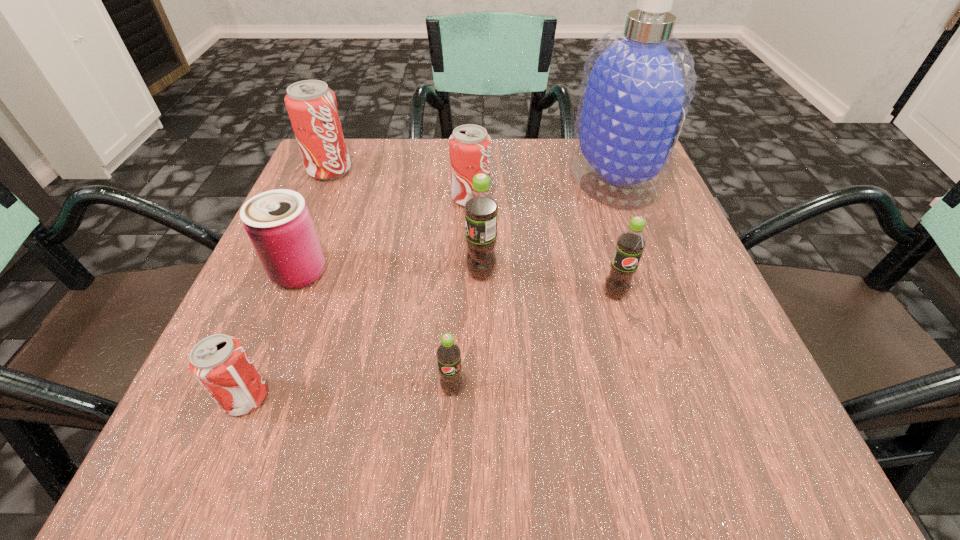
Identify which pink soda can is located as the second nearest to the cleansing agent. Please provide its 2D coordinates. Your answer should be formatted as a tuple, i.e. [(x, y)], where the tuple contains the x and y coordinates of a point satisfying the conditions above.

[(312, 107)]

Identify the location of pink soda can that is the second closest to the tallest object. (312, 107).

Identify which green soda is located as the nearest to the biggest green soda. Please provide its 2D coordinates. Your answer should be formatted as a tuple, i.e. [(x, y)], where the tuple contains the x and y coordinates of a point satisfying the conditions above.

[(630, 244)]

You are a GUI agent. You are given a task and a screenshot of the screen. Output one action in this format:
    pyautogui.click(x=<x>, y=<y>)
    Task: Click on the green soda that can be found as the third closest to the pink can
    The width and height of the screenshot is (960, 540).
    Given the screenshot: What is the action you would take?
    pyautogui.click(x=630, y=244)

You are a GUI agent. You are given a task and a screenshot of the screen. Output one action in this format:
    pyautogui.click(x=<x>, y=<y>)
    Task: Click on the free region that satisfies the following two spatial constraints: 1. on the front label of the biggest green soda; 2. on the front label of the nearest green soda
    
    Given the screenshot: What is the action you would take?
    481,388

Find the location of a particular element. vacant area in the image that satisfies the following two spatial constraints: 1. on the front side of the farthest pink soda can; 2. on the right side of the can is located at coordinates (286, 272).